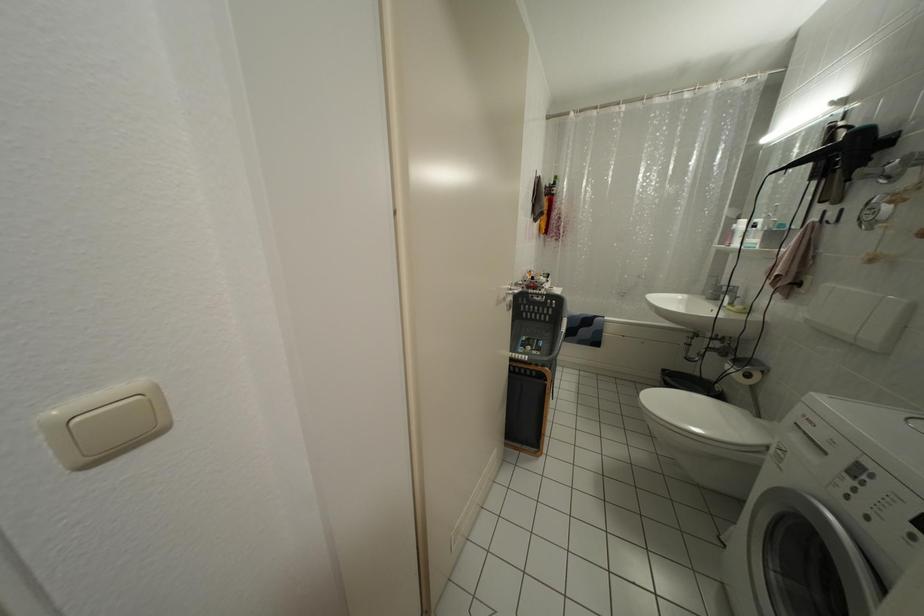
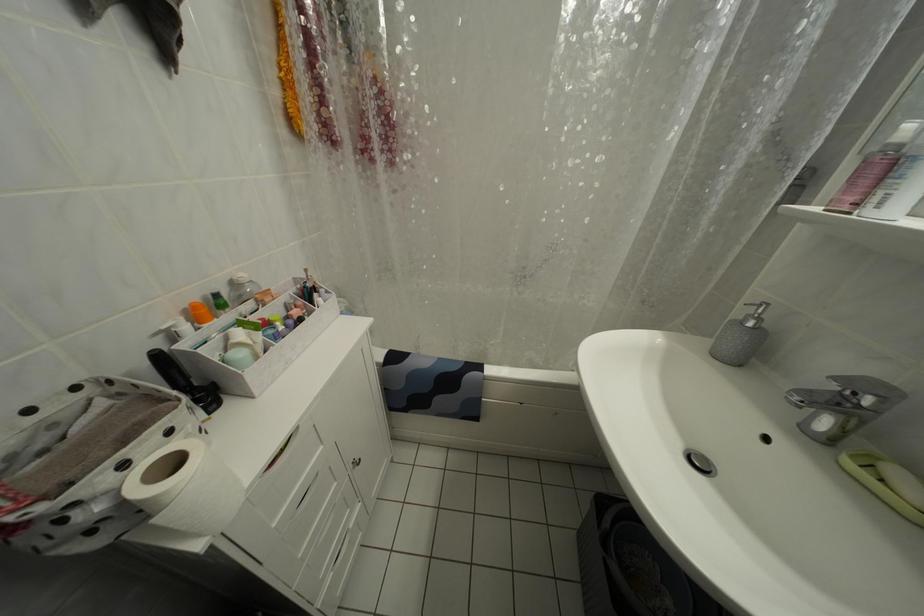
The images are taken continuously from a first-person perspective. In which direction are you moving?

The movement direction of the cameraman is right, forward.